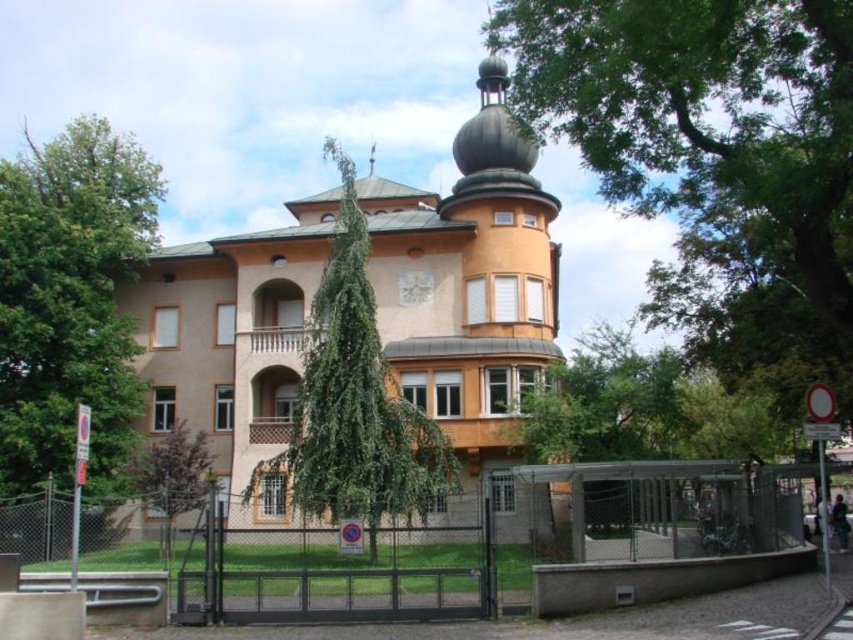
You are standing 10 meters away from the closed gate of the building. You want to take a photo of the green leafy tree at upper center from your current position. Is the tree within your camera lens range if your camera can focus up to 50 meters?

The green leafy tree at upper center is 39.41 meters away from the camera. Since your camera can focus up to 50 meters, the tree is within the camera lens range.

You are standing in front of the building and want to see the top of the green leafy tree at upper center. Can you see the top of the tree without moving your position, considering the height of the black metal fence at lower center?

The green leafy tree at upper center is taller than the black metal fence at lower center, so yes, you can see the top of the green leafy tree at upper center without moving your position.